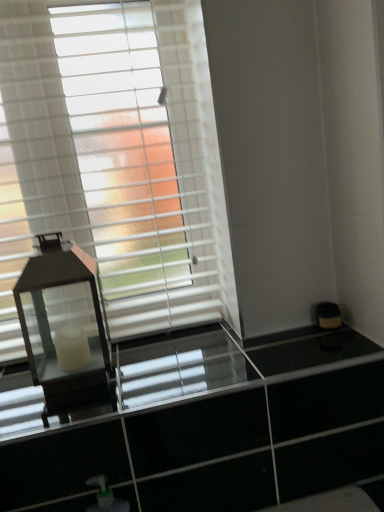
Question: Considering the positions of white matte window blind at upper left and clear glass dresser at center in the image, is white matte window blind at upper left taller or shorter than clear glass dresser at center?

Choices:
 (A) tall
 (B) short

Answer: (A)

Question: In terms of width, does white matte window blind at upper left look wider or thinner when compared to clear glass dresser at center?

Choices:
 (A) thin
 (B) wide

Answer: (A)

Question: Which of these objects is positioned closest to the clear glass dresser at center?

Choices:
 (A) white matte window blind at upper left
 (B) matte black lantern at left

Answer: (B)

Question: Which object is the farthest from the clear glass dresser at center?

Choices:
 (A) matte black lantern at left
 (B) white matte window blind at upper left

Answer: (B)